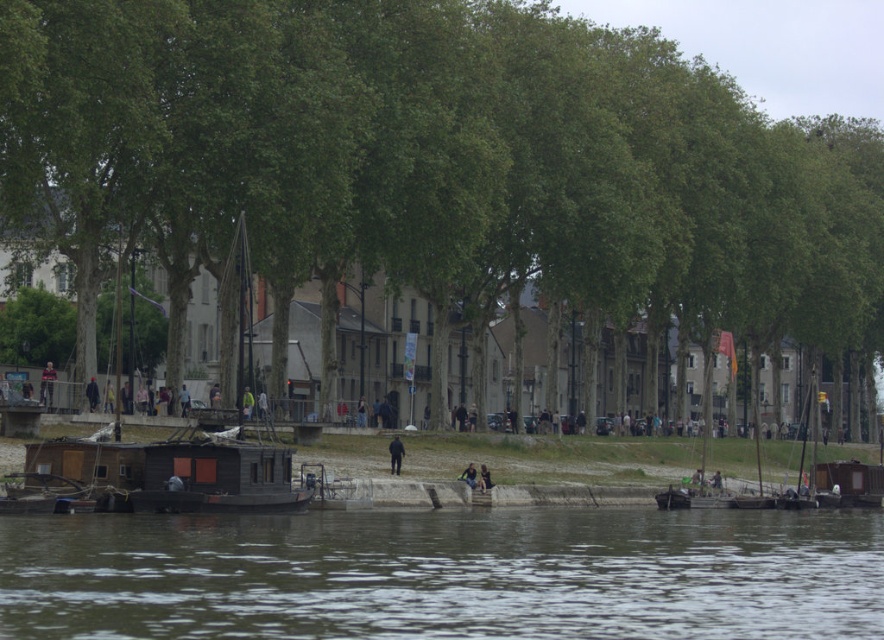
Who is more forward, [50,364] or [475,470]?

Positioned in front is point [475,470].

What do you see at coordinates (47, 384) in the screenshot? The width and height of the screenshot is (884, 640). I see `dark gray fabric jacket at center` at bounding box center [47, 384].

This screenshot has width=884, height=640. What are the coordinates of `dark gray fabric jacket at center` in the screenshot? It's located at (47, 384).

Can you confirm if dark brown wooden boat at center is shorter than dark gray fabric jacket at center?

No.

Between dark brown wooden boat at center and dark gray fabric jacket at center, which one is positioned higher?

Answer: dark gray fabric jacket at center is higher up.

Does point (184, 483) lie behind point (43, 381)?

No, (184, 483) is in front of (43, 381).

Where is `dark brown wooden boat at center`? This screenshot has width=884, height=640. dark brown wooden boat at center is located at coordinates (168, 474).

Which is behind, point (554, 566) or point (466, 481)?

The point (466, 481) is behind.

Measure the distance between brown water at lower center and camera.

They are 20.27 meters apart.

Between point (763, 589) and point (459, 477), which one is positioned in front?

Positioned in front is point (763, 589).

Find the location of a particular element. The height and width of the screenshot is (640, 884). brown water at lower center is located at coordinates (446, 573).